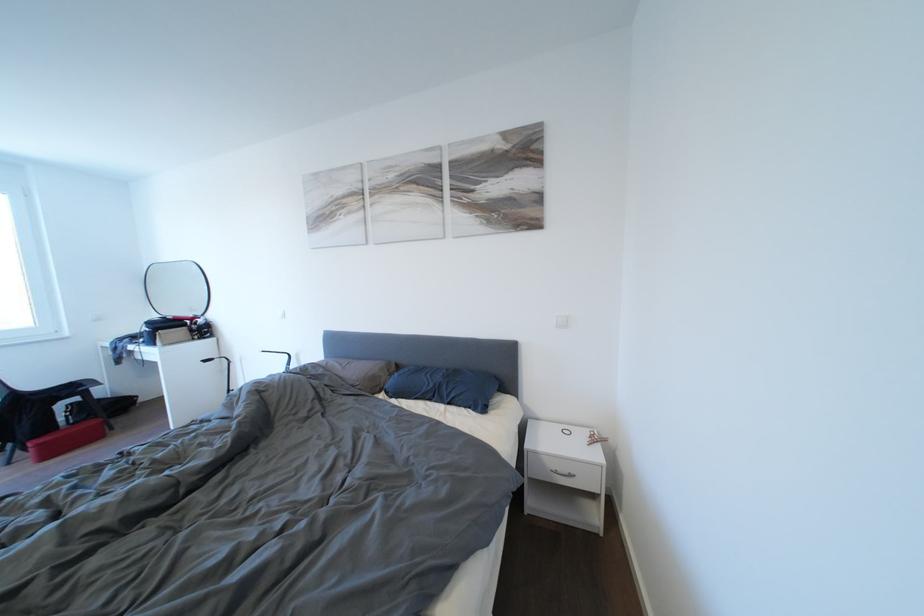
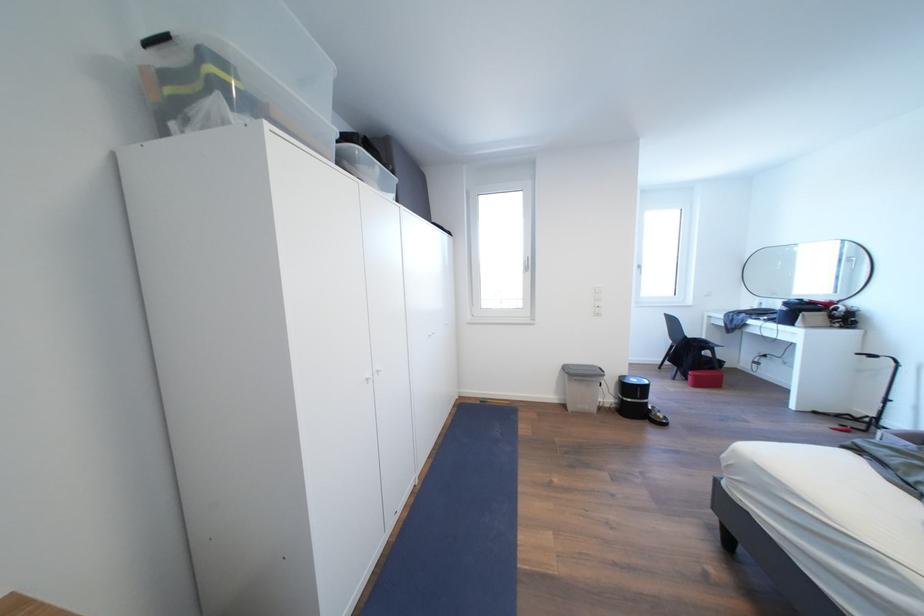
The point at (46, 450) is marked in the first image. Where is the corresponding point in the second image?

(703, 381)